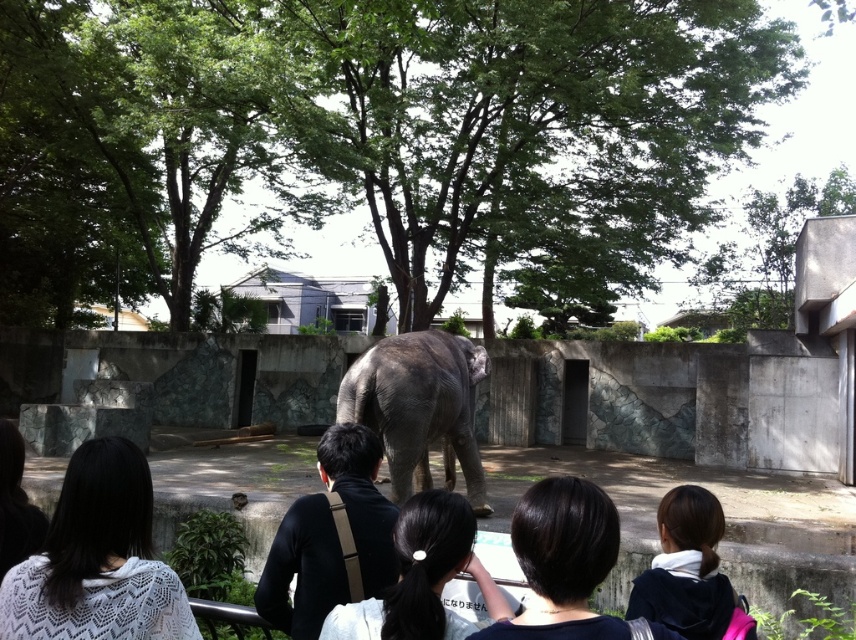
Question: Among these points, which one is farthest from the camera?

Choices:
 (A) (40, 545)
 (B) (296, 518)
 (C) (248, 611)
 (D) (557, 588)

Answer: (C)

Question: From the image, what is the correct spatial relationship of dark brown hair at center in relation to black hair at center?

Choices:
 (A) below
 (B) above

Answer: (A)

Question: Which point is closer to the camera taking this photo?

Choices:
 (A) (299, 502)
 (B) (78, 470)

Answer: (B)

Question: Can you confirm if gray matte elephant at center is smaller than dark brown hair at center?

Choices:
 (A) no
 (B) yes

Answer: (A)

Question: Can you confirm if dark brown hair at center is thinner than dark brown hair at lower right?

Choices:
 (A) yes
 (B) no

Answer: (B)

Question: Which point is closer to the camera taking this photo?

Choices:
 (A) (502, 611)
 (B) (24, 552)

Answer: (A)